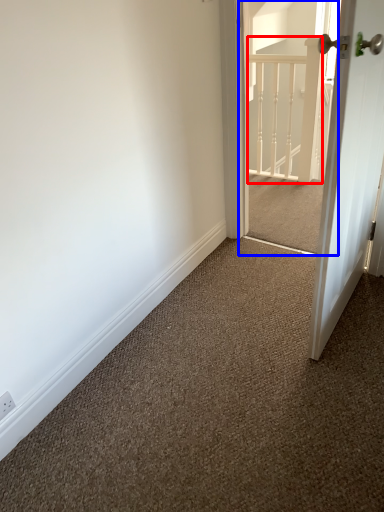
Question: Which object appears farthest to the camera in this image, rail (highlighted by a red box) or screen door (highlighted by a blue box)?

Choices:
 (A) rail
 (B) screen door

Answer: (A)